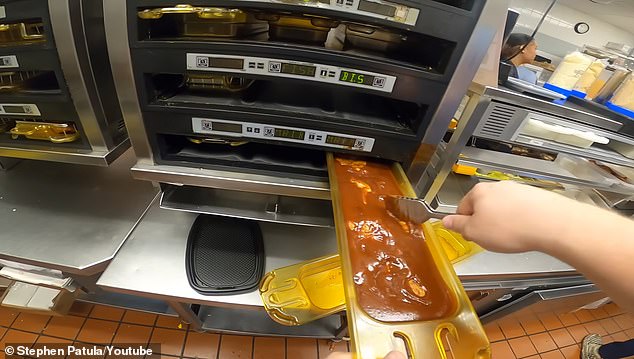
This screenshot has width=634, height=359. What are the coordinates of `floor` in the screenshot? It's located at (220, 345).